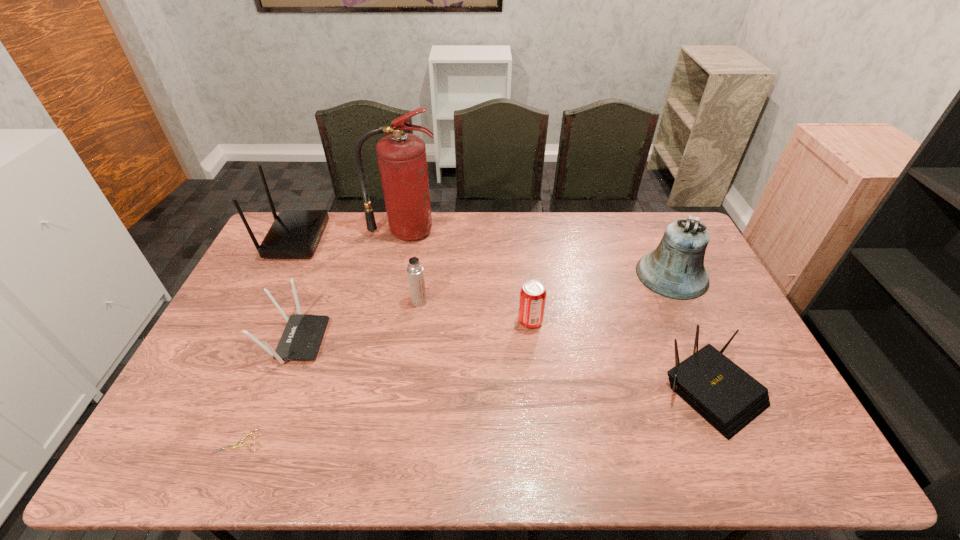
Where is `blank area at the left edge`? This screenshot has width=960, height=540. blank area at the left edge is located at coordinates (227, 373).

I want to click on free space at the far right corner, so click(x=653, y=228).

I want to click on unoccupied area between the second shortest router and the farthest router, so click(296, 289).

This screenshot has height=540, width=960. In order to click on vacant area that lies between the shortest router and the shortest object in this screenshot , I will do tap(476, 416).

Find the location of a particular element. This screenshot has width=960, height=540. vacant space in between the third object from right to left and the seventh tallest object is located at coordinates coord(621,356).

The image size is (960, 540). What are the coordinates of `blank region between the thermos bottle and the bell` in the screenshot? It's located at (545, 288).

Where is `free area in between the second shortest router and the bell`? Image resolution: width=960 pixels, height=540 pixels. free area in between the second shortest router and the bell is located at coordinates (484, 308).

Locate an element on the screen. This screenshot has width=960, height=540. free area in between the farthest router and the thermos bottle is located at coordinates (357, 270).

Locate an element on the screen. Image resolution: width=960 pixels, height=540 pixels. vacant space that is in between the shortest object and the bell is located at coordinates (456, 358).

The height and width of the screenshot is (540, 960). Identify the location of vacant region between the second shortest object and the tallest router. (504, 315).